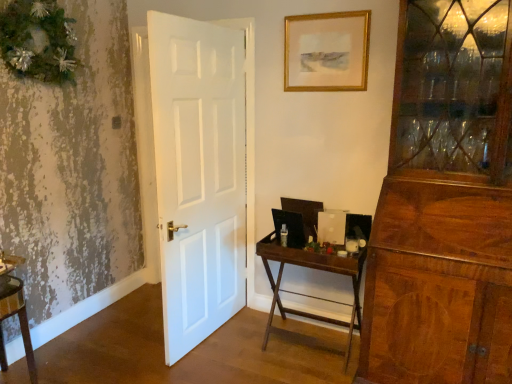
Question: Is wooden folding table at center to the left or to the right of gold-framed picture at upper center in the image?

Choices:
 (A) right
 (B) left

Answer: (B)

Question: From a real-world perspective, is wooden folding table at center positioned above or below gold-framed picture at upper center?

Choices:
 (A) above
 (B) below

Answer: (B)

Question: Which object is positioned farthest from the gold-framed picture at upper center?

Choices:
 (A) wooden folding table at center
 (B) wooden vanity at lower left
 (C) green textured wreath at upper left

Answer: (B)

Question: Which of these objects is positioned closest to the gold-framed picture at upper center?

Choices:
 (A) wooden folding table at center
 (B) wooden vanity at lower left
 (C) green textured wreath at upper left

Answer: (A)